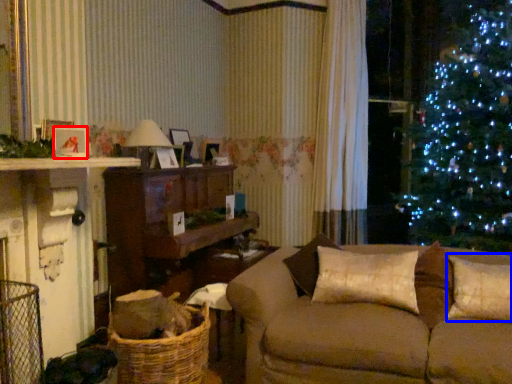
Question: Which object is further to the camera taking this photo, picture frame (highlighted by a red box) or pillow (highlighted by a blue box)?

Choices:
 (A) picture frame
 (B) pillow

Answer: (B)